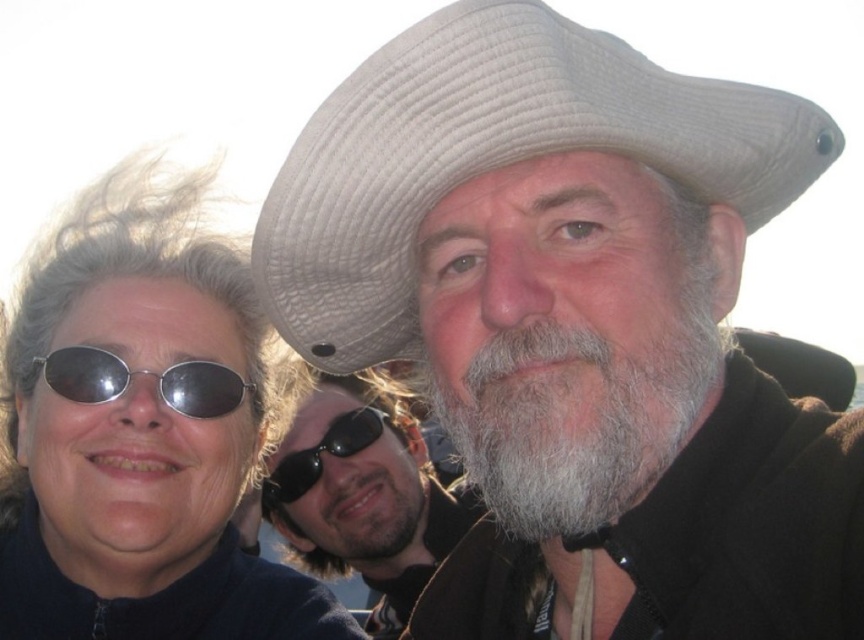
Who is shorter, matte black sunglasses at upper left or white woven cowboy hat at upper center?

white woven cowboy hat at upper center

Between matte black sunglasses at upper left and white woven cowboy hat at upper center, which one is positioned lower?

Positioned lower is matte black sunglasses at upper left.

What do you see at coordinates (141, 429) in the screenshot?
I see `matte black sunglasses at upper left` at bounding box center [141, 429].

This screenshot has height=640, width=864. Find the location of `matte black sunglasses at upper left`. matte black sunglasses at upper left is located at coordinates (141, 429).

Is graywoollybeard at center to the right of black reflective sunglasses at center from the viewer's perspective?

Indeed, graywoollybeard at center is positioned on the right side of black reflective sunglasses at center.

Measure the distance from graywoollybeard at center to black reflective sunglasses at center.

21.56 feet

The height and width of the screenshot is (640, 864). Describe the element at coordinates (570, 387) in the screenshot. I see `graywoollybeard at center` at that location.

Find the location of a particular element. This screenshot has height=640, width=864. graywoollybeard at center is located at coordinates (570, 387).

Can you confirm if matte black sunglasses at upper left is positioned to the left of silver reflective sunglasses at upper left?

Yes, matte black sunglasses at upper left is to the left of silver reflective sunglasses at upper left.

Does matte black sunglasses at upper left appear under silver reflective sunglasses at upper left?

Yes, matte black sunglasses at upper left is below silver reflective sunglasses at upper left.

This screenshot has height=640, width=864. What do you see at coordinates (141, 429) in the screenshot?
I see `matte black sunglasses at upper left` at bounding box center [141, 429].

Locate an element on the screen. The width and height of the screenshot is (864, 640). matte black sunglasses at upper left is located at coordinates (141, 429).